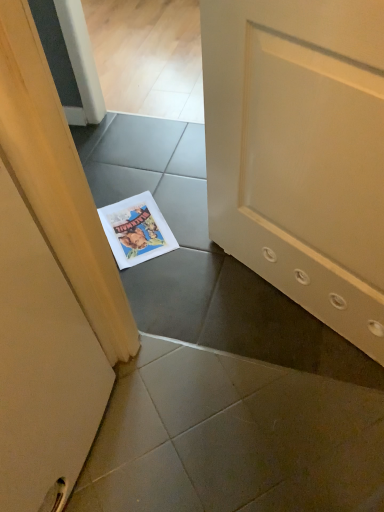
This screenshot has width=384, height=512. Find the location of `white paper comic book at center`. white paper comic book at center is located at coordinates (136, 230).

Measure the distance between white paper comic book at center and camera.

white paper comic book at center is 4.47 feet away from camera.

What do you see at coordinates (136, 230) in the screenshot? I see `white paper comic book at center` at bounding box center [136, 230].

At what (x,y) coordinates should I click in order to perform the action: click on wooden door at left. Please return your answer as a coordinate pair (x, y). Image resolution: width=384 pixels, height=512 pixels. Looking at the image, I should click on (x=49, y=285).

Image resolution: width=384 pixels, height=512 pixels. Describe the element at coordinates (49, 285) in the screenshot. I see `wooden door at left` at that location.

Where is `white paper comic book at center`? white paper comic book at center is located at coordinates (136, 230).

Considering the relative positions of white paper comic book at center and wooden door at left in the image provided, is white paper comic book at center to the left or to the right of wooden door at left?

white paper comic book at center is positioned on wooden door at left's right side.

Considering the positions of objects white paper comic book at center and wooden door at left in the image provided, who is behind, white paper comic book at center or wooden door at left?

white paper comic book at center is further away from the camera.

Considering the positions of points (160, 245) and (47, 211), is point (160, 245) closer to camera compared to point (47, 211)?

No, it is behind (47, 211).

From the image's perspective, between white paper comic book at center and wooden door at left, who is located below?

wooden door at left is shown below in the image.

From a real-world perspective, is white paper comic book at center physically located above or below wooden door at left?

In terms of real-world spatial position, white paper comic book at center is below wooden door at left.

Considering the sizes of objects white paper comic book at center and wooden door at left in the image provided, who is thinner, white paper comic book at center or wooden door at left?

white paper comic book at center.

Can you confirm if white paper comic book at center is shorter than wooden door at left?

Indeed, white paper comic book at center has a lesser height compared to wooden door at left.

Can you confirm if white paper comic book at center is bigger than wooden door at left?

Actually, white paper comic book at center might be smaller than wooden door at left.

Is white paper comic book at center not inside wooden door at left?

That's correct, white paper comic book at center is outside of wooden door at left.

Are white paper comic book at center and wooden door at left making contact?

No.

Is white paper comic book at center turned away from wooden door at left?

No, wooden door at left is not at the back of white paper comic book at center.

What's the angular difference between white paper comic book at center and wooden door at left's facing directions?

The angle between the facing direction of white paper comic book at center and the facing direction of wooden door at left is 48 degrees.

Measure the distance from white paper comic book at center to wooden door at left.

white paper comic book at center is 20.54 inches from wooden door at left.

Where is `door located above the white paper comic book at center (from a real-world perspective)`? door located above the white paper comic book at center (from a real-world perspective) is located at coordinates (49, 285).

Is wooden door at left to the left or to the right of white paper comic book at center in the image?

From the image, it's evident that wooden door at left is to the left of white paper comic book at center.

Which object is further away from the camera, wooden door at left or white paper comic book at center?

white paper comic book at center is behind.

Considering the positions of point (78, 382) and point (172, 237), is point (78, 382) closer or farther from the camera than point (172, 237)?

Point (78, 382) is closer to the camera than point (172, 237).

From the image's perspective, does wooden door at left appear higher than white paper comic book at center?

No, from the image's perspective, wooden door at left is not over white paper comic book at center.

From a real-world perspective, between wooden door at left and white paper comic book at center, who is vertically higher?

From a 3D spatial view, wooden door at left is above.

Does wooden door at left have a lesser width compared to white paper comic book at center?

No.

In terms of height, does wooden door at left look taller or shorter compared to white paper comic book at center?

wooden door at left is taller than white paper comic book at center.

Looking at the image, does wooden door at left seem bigger or smaller compared to white paper comic book at center?

wooden door at left is bigger than white paper comic book at center.

Is wooden door at left completely or partially outside of white paper comic book at center?

Yes, wooden door at left is not within white paper comic book at center.

Is the surface of wooden door at left in direct contact with white paper comic book at center?

They are not placed beside each other.

Is wooden door at left facing towards white paper comic book at center?

No.

Measure the distance between wooden door at left and white paper comic book at center.

The distance of wooden door at left from white paper comic book at center is 52.18 centimeters.

Locate an element on the screen. The height and width of the screenshot is (512, 384). door on the left side of white paper comic book at center is located at coordinates (49, 285).

Identify the location of comic book on the right of wooden door at left. The width and height of the screenshot is (384, 512). (136, 230).

This screenshot has height=512, width=384. Identify the location of door located above the white paper comic book at center (from a real-world perspective). (49, 285).